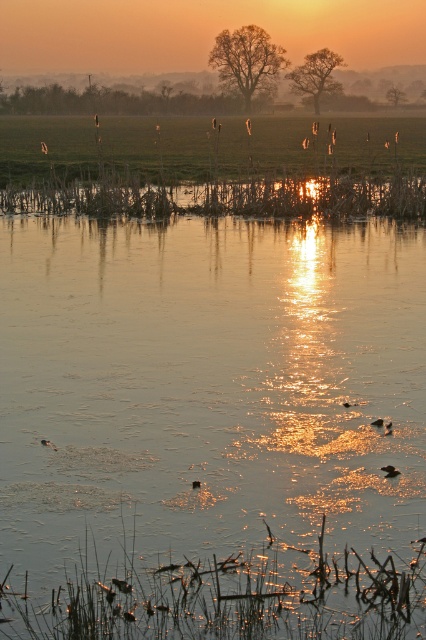
Question: In this image, where is translucent water at center located relative to translucent reed at center?

Choices:
 (A) below
 (B) above

Answer: (A)

Question: Does translucent water at center have a larger size compared to translucent reed at center?

Choices:
 (A) yes
 (B) no

Answer: (A)

Question: Can you confirm if translucent water at center is wider than translucent reed at center?

Choices:
 (A) yes
 (B) no

Answer: (B)

Question: Which point is closer to the camera?

Choices:
 (A) translucent water at center
 (B) translucent reed at center

Answer: (A)

Question: Among these points, which one is farthest from the camera?

Choices:
 (A) (370, 202)
 (B) (261, 496)

Answer: (A)